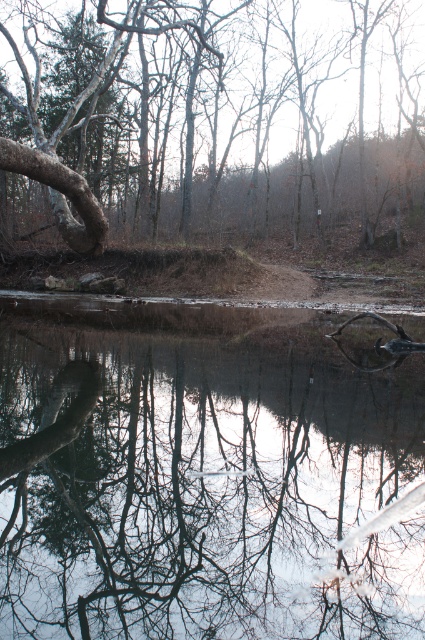
You are standing on a wooden dock that is 10 feet away from the transparent glass lake at center. Can you step onto the lake without getting your feet wet?

The distance between you and the transparent glass lake at center is 12.12 feet, which is farther than the 10 feet of the dock. Therefore, you cannot step onto the lake from the dock without getting your feet wet.

You are standing at the edge of the water in the scene. There is a point marked at coordinates (206, 474). What does this point represent in the image?

The point at coordinates (206, 474) represents the transparent glass lake at center.

You are standing at the origin point in the coordinate system of the image. Where is the transparent glass lake at center located?

The transparent glass lake at center is located at point (x=206, y=474).